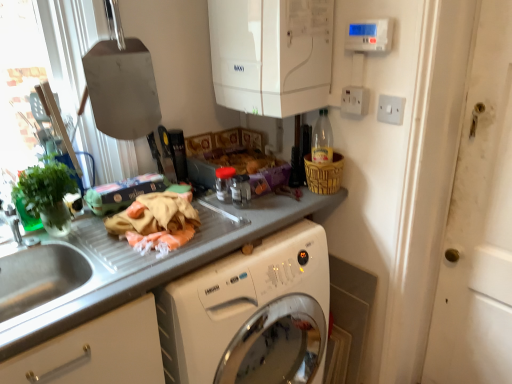
Identify the location of vacant area that is situated to the right of transparent plastic spice jar at center, which is counted as the 2th appliance, starting from the right. This screenshot has width=512, height=384. (276, 206).